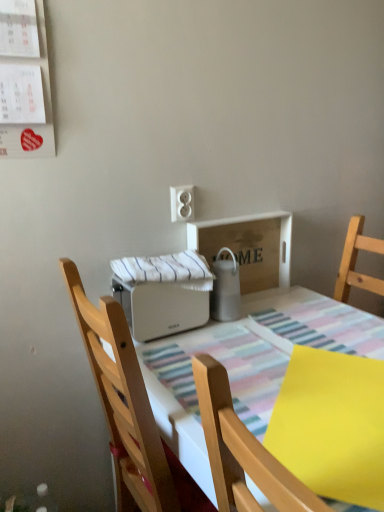
Question: Is white plastic toaster at center further to the viewer compared to wooden chair at center?

Choices:
 (A) no
 (B) yes

Answer: (A)

Question: Considering the relative sizes of white plastic toaster at center and wooden chair at center in the image provided, is white plastic toaster at center bigger than wooden chair at center?

Choices:
 (A) yes
 (B) no

Answer: (A)

Question: Is white plastic toaster at center oriented away from wooden chair at center?

Choices:
 (A) no
 (B) yes

Answer: (B)

Question: Can you confirm if white plastic toaster at center is positioned to the left of wooden chair at center?

Choices:
 (A) no
 (B) yes

Answer: (A)

Question: From a real-world perspective, is white plastic toaster at center below wooden chair at center?

Choices:
 (A) no
 (B) yes

Answer: (B)

Question: Is white plastic outlet at upper center taller or shorter than yellow matte paper at lower right?

Choices:
 (A) tall
 (B) short

Answer: (A)

Question: Is point (175, 214) positioned closer to the camera than point (362, 409)?

Choices:
 (A) closer
 (B) farther

Answer: (B)

Question: Choose the correct answer: Is white plastic outlet at upper center inside yellow matte paper at lower right or outside it?

Choices:
 (A) inside
 (B) outside

Answer: (B)

Question: Looking at their shapes, would you say white plastic outlet at upper center is wider or thinner than yellow matte paper at lower right?

Choices:
 (A) wide
 (B) thin

Answer: (B)

Question: In the image, is yellow matte paper at lower right positioned in front of or behind white plastic toaster at center?

Choices:
 (A) front
 (B) behind

Answer: (B)

Question: Based on their sizes in the image, would you say yellow matte paper at lower right is bigger or smaller than white plastic toaster at center?

Choices:
 (A) big
 (B) small

Answer: (B)

Question: From a real-world perspective, relative to white plastic toaster at center, is yellow matte paper at lower right vertically above or below?

Choices:
 (A) above
 (B) below

Answer: (A)

Question: From the image's perspective, relative to white plastic toaster at center, is yellow matte paper at lower right above or below?

Choices:
 (A) below
 (B) above

Answer: (B)

Question: Relative to white plastic toaster at center, is satin silver thermos at center, arranged as the first appliance when viewed from the right, in front or behind?

Choices:
 (A) front
 (B) behind

Answer: (B)

Question: From their relative heights in the image, would you say satin silver thermos at center, arranged as the first appliance when viewed from the right, is taller or shorter than white plastic toaster at center?

Choices:
 (A) tall
 (B) short

Answer: (B)